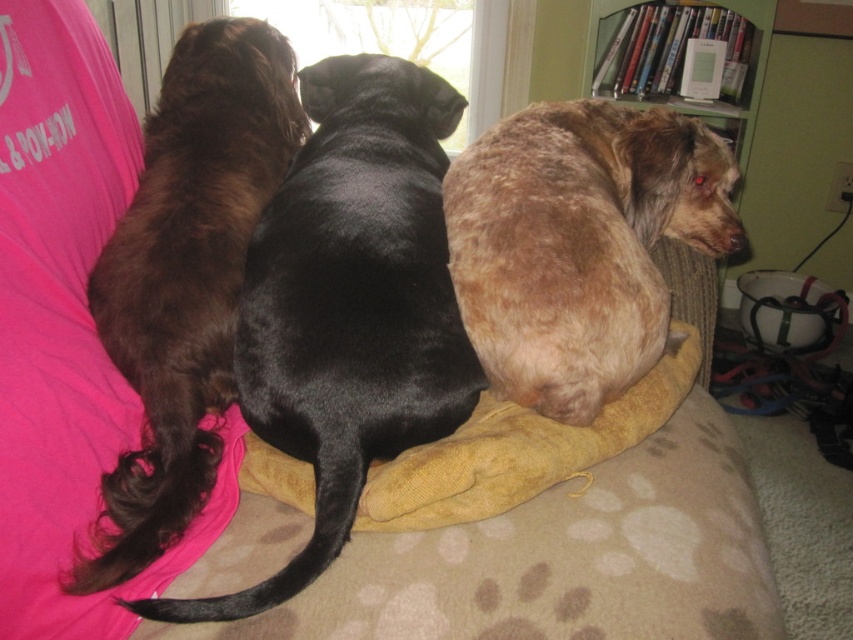
Which is behind, point (386, 337) or point (494, 317)?

Point (494, 317)

Where is `brown fur dog at center`? This screenshot has height=640, width=853. brown fur dog at center is located at coordinates (349, 305).

Between point (376, 205) and point (165, 209), which one is positioned in front?

Point (376, 205) is more forward.

Who is more distant from viewer, (341, 65) or (229, 195)?

Point (341, 65)

Is point (296, 256) positioned after point (107, 269)?

No.

Where is `brown fur dog at center`? The width and height of the screenshot is (853, 640). brown fur dog at center is located at coordinates click(349, 305).

Can you confirm if fuzzy brown dog at right is smaller than yellow fabric at center?

Incorrect, fuzzy brown dog at right is not smaller in size than yellow fabric at center.

Between fuzzy brown dog at right and yellow fabric at center, which one is positioned lower?

Positioned lower is yellow fabric at center.

Locate an element on the screen. This screenshot has width=853, height=640. fuzzy brown dog at right is located at coordinates (579, 243).